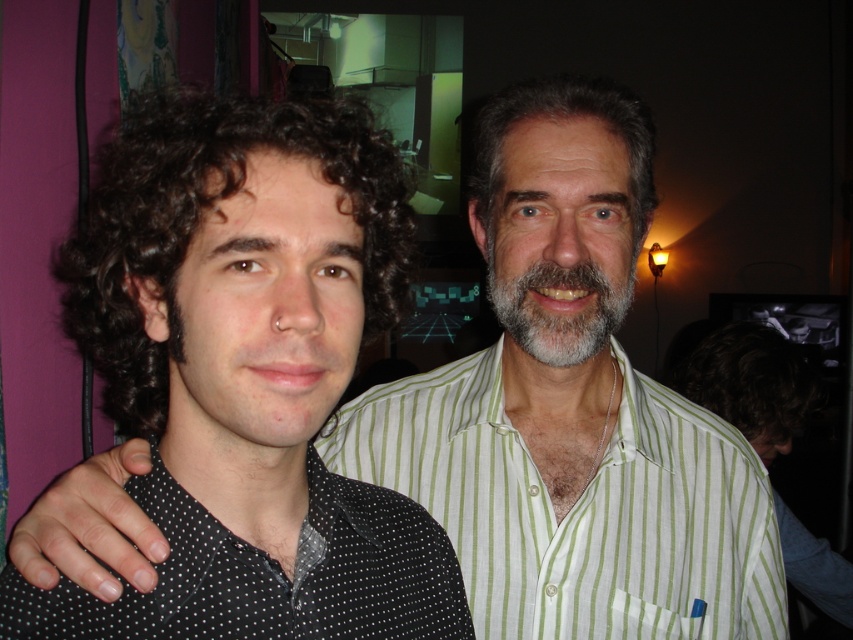
Question: Which point is farther from the camera taking this photo?

Choices:
 (A) pyautogui.click(x=531, y=106)
 (B) pyautogui.click(x=682, y=392)

Answer: (B)

Question: Is green striped shirt at center above grayhairbeard at center?

Choices:
 (A) yes
 (B) no

Answer: (B)

Question: Where is green striped shirt at center located in relation to dark curly hair at right in the image?

Choices:
 (A) right
 (B) left

Answer: (B)

Question: Is gray matte hair at upper center positioned before grayhairbeard at center?

Choices:
 (A) yes
 (B) no

Answer: (B)

Question: Which point is farther to the camera?

Choices:
 (A) (148, 141)
 (B) (579, 326)

Answer: (B)

Question: Which object is the closest to the gray matte hair at upper center?

Choices:
 (A) dark curly hair at right
 (B) dark curly hair at left
 (C) green striped shirt at center

Answer: (C)